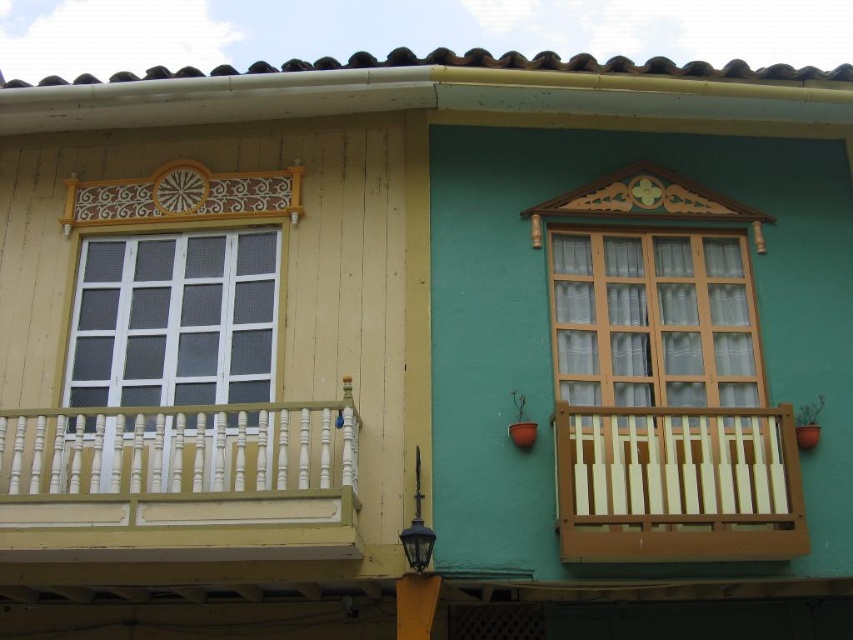
Is point (578, 429) in front of point (67, 376)?

Yes, it is.

Does wooden at right appear on the left side of white wooden window at left?

In fact, wooden at right is to the right of white wooden window at left.

Measure the distance between point (718, 484) and camera.

A distance of 40.42 feet exists between point (718, 484) and camera.

At what (x,y) coordinates should I click in order to perform the action: click on wooden at right. Please return your answer as a coordinate pair (x, y). The height and width of the screenshot is (640, 853). Looking at the image, I should click on (677, 484).

Who is positioned more to the right, wooden at right or translucent glass window at center?

Positioned to the right is wooden at right.

Does wooden at right appear on the right side of translucent glass window at center?

Indeed, wooden at right is positioned on the right side of translucent glass window at center.

What do you see at coordinates (677, 484) in the screenshot? The height and width of the screenshot is (640, 853). I see `wooden at right` at bounding box center [677, 484].

This screenshot has width=853, height=640. Find the location of `wooden at right`. wooden at right is located at coordinates (677, 484).

What do you see at coordinates (180, 483) in the screenshot? I see `white painted wood balcony at left` at bounding box center [180, 483].

Measure the distance between white painted wood balcony at left and wooden at right.

white painted wood balcony at left is 3.83 meters away from wooden at right.

Is point (296, 467) more distant than point (695, 472)?

No, it is in front of (695, 472).

This screenshot has height=640, width=853. I want to click on white painted wood balcony at left, so click(x=180, y=483).